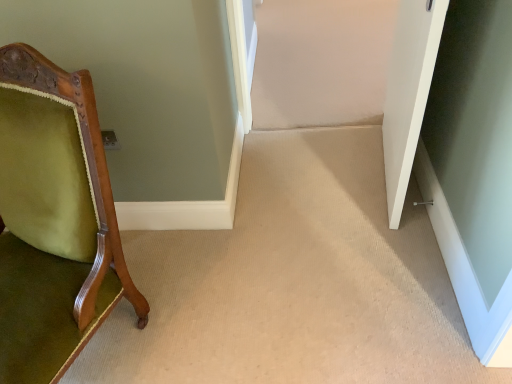
What is the approximate width of white matte door at right?

white matte door at right is 6.55 inches wide.

Identify the location of white matte door at right. This screenshot has height=384, width=512. (408, 93).

Describe the element at coordinates (53, 220) in the screenshot. I see `green velvet chair at left` at that location.

This screenshot has width=512, height=384. In order to click on white matte door at right in this screenshot , I will do `click(408, 93)`.

Is point (410, 18) farther from camera compared to point (479, 255)?

Yes, it is behind point (479, 255).

Is clear glass door at lower right completely or partially inside white matte door at right?

Actually, clear glass door at lower right is outside white matte door at right.

The height and width of the screenshot is (384, 512). I want to click on door on the left of the clear glass door at lower right, so click(408, 93).

From a real-world perspective, who is located higher, white matte door at right or clear glass door at lower right?

white matte door at right, from a real-world perspective.

Is clear glass door at lower right looking in the opposite direction of white matte door at right?

clear glass door at lower right is not turned away from white matte door at right.

Which is less distant, (441, 1) or (417, 31)?

Point (441, 1) appears to be closer to the viewer than point (417, 31).

Based on the photo, from a real-world perspective, is clear glass door at lower right positioned under white matte door at right based on gravity?

Yes, from a real-world perspective, clear glass door at lower right is under white matte door at right.

Considering their positions, is clear glass door at lower right located in front of or behind white matte door at right?

Clearly, clear glass door at lower right is behind white matte door at right.

Does green velvet chair at left have a larger size compared to clear glass door at lower right?

Correct, green velvet chair at left is larger in size than clear glass door at lower right.

Which is behind, point (56, 218) or point (451, 12)?

Point (451, 12)

Measure the distance from green velvet chair at left to clear glass door at lower right.

1.16 meters.

Based on their positions, is green velvet chair at left located to the left or right of clear glass door at lower right?

In the image, green velvet chair at left appears on the left side of clear glass door at lower right.

Find the location of a particular element. door lying behind the green velvet chair at left is located at coordinates (408, 93).

Considering the sizes of objects green velvet chair at left and white matte door at right in the image provided, who is smaller, green velvet chair at left or white matte door at right?

white matte door at right is smaller.

Is green velvet chair at left inside or outside of white matte door at right?

green velvet chair at left lies outside white matte door at right.

Can you confirm if white matte door at right is smaller than green velvet chair at left?

Indeed, white matte door at right has a smaller size compared to green velvet chair at left.

Is there a large distance between white matte door at right and green velvet chair at left?

That's right, there is a large distance between white matte door at right and green velvet chair at left.

From the image's perspective, which is above, white matte door at right or green velvet chair at left?

white matte door at right is shown above in the image.

Consider the image. Which is closer to the camera, (429, 18) or (19, 362)?

Clearly, point (429, 18) is more distant from the camera than point (19, 362).

Does clear glass door at lower right contain green velvet chair at left?

No, green velvet chair at left is not surrounded by clear glass door at lower right.

Identify the location of chair above the clear glass door at lower right (from a real-world perspective). The width and height of the screenshot is (512, 384). (53, 220).

Consider the image. Does clear glass door at lower right have a greater height compared to green velvet chair at left?

Incorrect, the height of clear glass door at lower right is not larger of that of green velvet chair at left.

The width and height of the screenshot is (512, 384). In the image, there is a white matte door at right. In order to click on glass door below it (from the image's perspective) in this screenshot , I will do click(458, 151).

At what (x,y) coordinates should I click in order to perform the action: click on glass door behind the white matte door at right. Please return your answer as a coordinate pair (x, y). Looking at the image, I should click on (458, 151).

Estimate the real-world distances between objects in this image. Which object is closer to clear glass door at lower right, green velvet chair at left or white matte door at right?

Based on the image, white matte door at right appears to be nearer to clear glass door at lower right.

Based on their spatial positions, is white matte door at right or clear glass door at lower right further from green velvet chair at left?

Among the two, clear glass door at lower right is located further to green velvet chair at left.

From the image, which object appears to be nearer to white matte door at right, green velvet chair at left or clear glass door at lower right?

clear glass door at lower right is closer to white matte door at right.

Considering their positions, is clear glass door at lower right positioned further to green velvet chair at left than white matte door at right?

clear glass door at lower right is further to green velvet chair at left.

Considering their positions, is clear glass door at lower right positioned closer to white matte door at right than green velvet chair at left?

Based on the image, clear glass door at lower right appears to be nearer to white matte door at right.

When comparing their distances from clear glass door at lower right, does white matte door at right or green velvet chair at left seem further?

green velvet chair at left is further to clear glass door at lower right.

I want to click on door between green velvet chair at left and clear glass door at lower right, so click(408, 93).